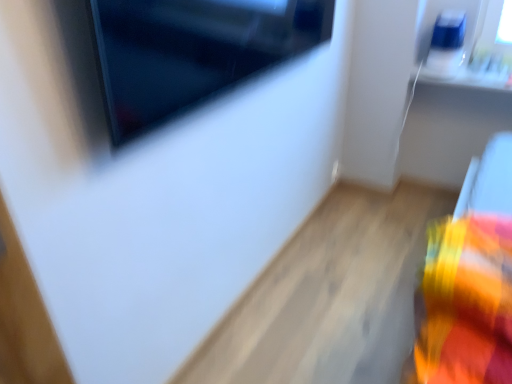
This screenshot has height=384, width=512. What do you see at coordinates (192, 51) in the screenshot?
I see `matte black television at upper left` at bounding box center [192, 51].

Identify the location of matte black television at upper left. (192, 51).

Where is `matte black television at upper left`? matte black television at upper left is located at coordinates (192, 51).